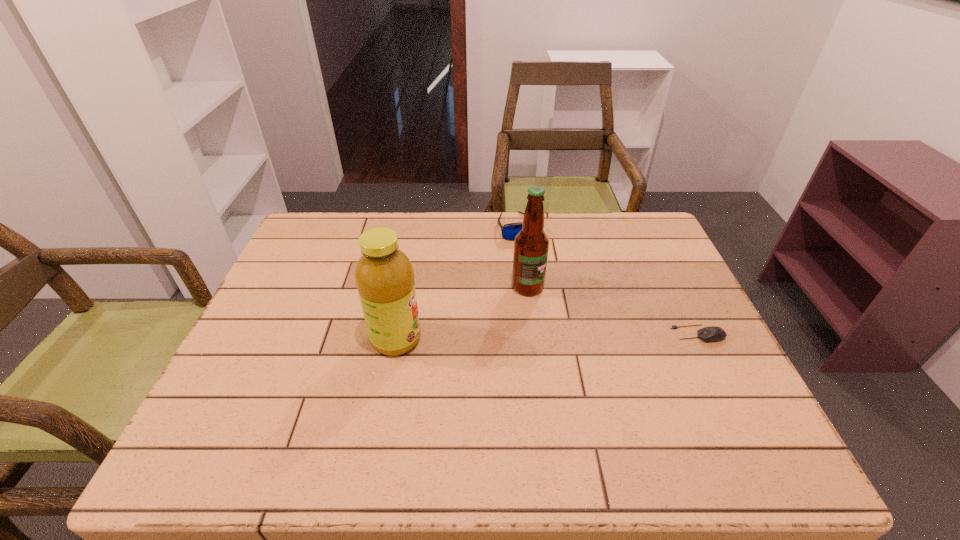
Where is `the leftmost object`? The width and height of the screenshot is (960, 540). the leftmost object is located at coordinates (384, 275).

Locate an element on the screen. The height and width of the screenshot is (540, 960). mouse is located at coordinates (714, 333).

Where is `the rightmost object`? The width and height of the screenshot is (960, 540). the rightmost object is located at coordinates (714, 333).

Where is `the second farthest object`? the second farthest object is located at coordinates (531, 245).

Where is `the farthest object`? the farthest object is located at coordinates (509, 231).

Locate an element on the screen. the third tallest object is located at coordinates (509, 231).

You are a GUI agent. You are given a task and a screenshot of the screen. Output one action in this format:
    pyautogui.click(x=<x>, y=<y>)
    Task: Click on the free space located on the front label of the leftmost object
    
    Given the screenshot: What is the action you would take?
    551,339

In order to click on vacant region located 0.120m on the back of the shortest object in this screenshot , I will do `click(678, 292)`.

Where is `vacant space located 0.060m on the label of the beer bottle`? The image size is (960, 540). vacant space located 0.060m on the label of the beer bottle is located at coordinates tap(551, 310).

Find the location of `free space located 0.170m on the label of the beer bottle`. free space located 0.170m on the label of the beer bottle is located at coordinates (580, 338).